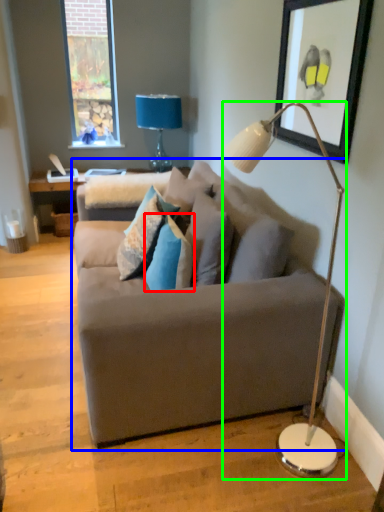
Question: Considering the real-world distances, which object is closest to pillow (highlighted by a red box)? studio couch (highlighted by a blue box) or lamp (highlighted by a green box).

Choices:
 (A) studio couch
 (B) lamp

Answer: (A)